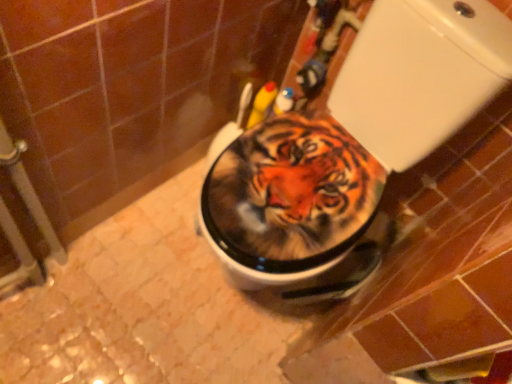
Where is `printed plastic toilet seat at center`? printed plastic toilet seat at center is located at coordinates (349, 147).

What do you see at coordinates (349, 147) in the screenshot? I see `printed plastic toilet seat at center` at bounding box center [349, 147].

What is the approximate width of printed plastic toilet seat at center?

printed plastic toilet seat at center is 69.82 centimeters wide.

The height and width of the screenshot is (384, 512). In order to click on printed plastic toilet seat at center in this screenshot , I will do `click(349, 147)`.